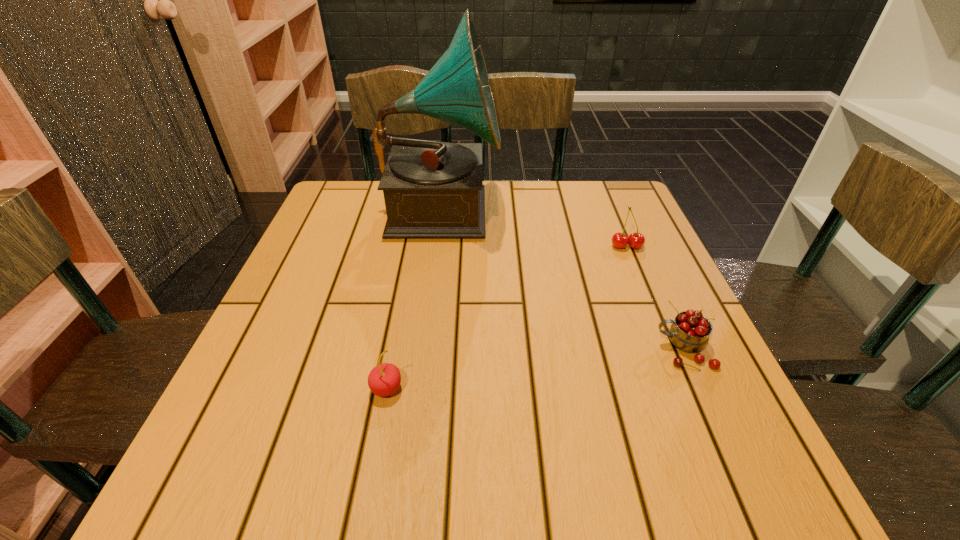
You are a GUI agent. You are given a task and a screenshot of the screen. Output one action in this format:
    pyautogui.click(x=<x>, y=<y>)
    Task: Click on the free point between the second farthest object and the record player
    The height and width of the screenshot is (540, 960).
    Given the screenshot: What is the action you would take?
    pyautogui.click(x=534, y=227)

You are a GUI agent. You are given a task and a screenshot of the screen. Output one action in this format:
    pyautogui.click(x=<x>, y=<y>)
    Task: Click on the vacant space that's between the farthest cherry and the second nearest cherry
    This screenshot has width=960, height=540.
    Given the screenshot: What is the action you would take?
    pyautogui.click(x=655, y=298)

Where is `free spot between the nearest object and the farthest object`? The width and height of the screenshot is (960, 540). free spot between the nearest object and the farthest object is located at coordinates (414, 298).

This screenshot has width=960, height=540. Identify the location of free space between the nearest object and the third nearest object. (507, 318).

Locate an element on the screen. The image size is (960, 540). free space between the farthest object and the third farthest object is located at coordinates (563, 279).

Find the location of a particular element. blank region between the leftmost cherry and the third farthest object is located at coordinates (535, 369).

You are a GUI agent. You are given a task and a screenshot of the screen. Output one action in this format:
    pyautogui.click(x=<x>, y=<y>)
    Task: Click on the vacant region between the farthest object and the third nearest object
    
    Given the screenshot: What is the action you would take?
    pyautogui.click(x=534, y=227)

The width and height of the screenshot is (960, 540). I want to click on vacant area that lies between the second nearest object and the farthest object, so click(563, 279).

Where is `free space between the farthest cherry and the second farthest cherry`? The image size is (960, 540). free space between the farthest cherry and the second farthest cherry is located at coordinates (655, 298).

You are a GUI agent. You are given a task and a screenshot of the screen. Output one action in this format:
    pyautogui.click(x=<x>, y=<y>)
    Task: Click on the unoccupied area between the leftmost cherry and the record player
    
    Given the screenshot: What is the action you would take?
    pyautogui.click(x=414, y=298)